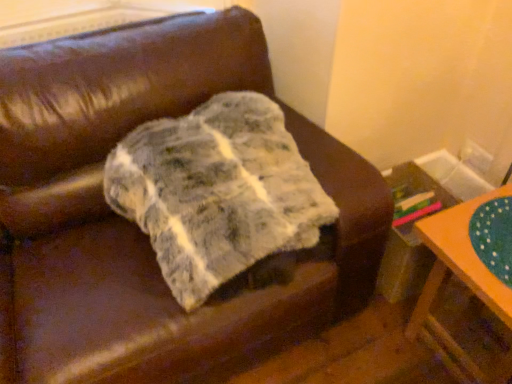
This screenshot has width=512, height=384. What do you see at coordinates (468, 275) in the screenshot?
I see `orange painted wood table at lower right` at bounding box center [468, 275].

The width and height of the screenshot is (512, 384). Find the location of `orange painted wood table at lower right`. orange painted wood table at lower right is located at coordinates (468, 275).

Describe the element at coordinates (217, 191) in the screenshot. I see `marble-like fabric at center` at that location.

What are the coordinates of `marble-like fabric at center` in the screenshot? It's located at (217, 191).

Locate an element on the screen. The image size is (512, 384). orange painted wood table at lower right is located at coordinates (468, 275).

Which object is positioned more to the right, marble-like fabric at center or orange painted wood table at lower right?

orange painted wood table at lower right is more to the right.

Between marble-like fabric at center and orange painted wood table at lower right, which one is positioned behind?

Positioned behind is orange painted wood table at lower right.

Considering the positions of point (296, 176) and point (466, 232), is point (296, 176) closer or farther from the camera than point (466, 232)?

Point (296, 176) is positioned farther from the camera compared to point (466, 232).

From the image's perspective, which is below, marble-like fabric at center or orange painted wood table at lower right?

orange painted wood table at lower right is shown below in the image.

From a real-world perspective, is marble-like fabric at center beneath orange painted wood table at lower right?

No, from a real-world perspective, marble-like fabric at center is not under orange painted wood table at lower right.

Looking at their sizes, would you say marble-like fabric at center is wider or thinner than orange painted wood table at lower right?

Considering their sizes, marble-like fabric at center looks broader than orange painted wood table at lower right.

From the picture: Considering the sizes of marble-like fabric at center and orange painted wood table at lower right in the image, is marble-like fabric at center taller or shorter than orange painted wood table at lower right?

Considering their sizes, marble-like fabric at center has less height than orange painted wood table at lower right.

Considering the sizes of objects marble-like fabric at center and orange painted wood table at lower right in the image provided, who is smaller, marble-like fabric at center or orange painted wood table at lower right?

orange painted wood table at lower right is smaller.

Can we say marble-like fabric at center lies outside orange painted wood table at lower right?

Absolutely, marble-like fabric at center is external to orange painted wood table at lower right.

Are marble-like fabric at center and orange painted wood table at lower right beside each other?

No, marble-like fabric at center is not touching orange painted wood table at lower right.

Is marble-like fabric at center turned away from orange painted wood table at lower right?

No, orange painted wood table at lower right is not at the back of marble-like fabric at center.

How many degrees apart are the facing directions of marble-like fabric at center and orange painted wood table at lower right?

They differ by 93.9 degrees in their facing directions.

You are a GUI agent. You are given a task and a screenshot of the screen. Output one action in this format:
    pyautogui.click(x=<x>, y=<y>)
    Task: Click on the blanket above the orange painted wood table at lower right (from a real-world perspective)
    This screenshot has height=384, width=512.
    Given the screenshot: What is the action you would take?
    pyautogui.click(x=217, y=191)

Does orange painted wood table at lower right appear on the right side of marble-like fabric at center?

Yes.

Which is in front, orange painted wood table at lower right or marble-like fabric at center?

marble-like fabric at center.

Considering the positions of point (426, 221) and point (222, 239), is point (426, 221) closer or farther from the camera than point (222, 239)?

Clearly, point (426, 221) is more distant from the camera than point (222, 239).

From the image's perspective, between orange painted wood table at lower right and marble-like fabric at center, which one is located above?

marble-like fabric at center appears higher in the image.

From a real-world perspective, is orange painted wood table at lower right above or below marble-like fabric at center?

In terms of real-world spatial position, orange painted wood table at lower right is below marble-like fabric at center.

Does orange painted wood table at lower right have a greater width compared to marble-like fabric at center?

Incorrect, the width of orange painted wood table at lower right does not surpass that of marble-like fabric at center.

Between orange painted wood table at lower right and marble-like fabric at center, which one has less height?

With less height is marble-like fabric at center.

Considering the sizes of objects orange painted wood table at lower right and marble-like fabric at center in the image provided, who is bigger, orange painted wood table at lower right or marble-like fabric at center?

Bigger between the two is marble-like fabric at center.

Would you say orange painted wood table at lower right is outside marble-like fabric at center?

Indeed, orange painted wood table at lower right is completely outside marble-like fabric at center.

Is orange painted wood table at lower right touching marble-like fabric at center?

orange painted wood table at lower right and marble-like fabric at center are clearly separated.

Is orange painted wood table at lower right oriented towards marble-like fabric at center?

No, orange painted wood table at lower right does not turn towards marble-like fabric at center.

Find the location of a particular element. table lying behind the marble-like fabric at center is located at coordinates (468, 275).

You are a GUI agent. You are given a task and a screenshot of the screen. Output one action in this format:
    pyautogui.click(x=<x>, y=<y>)
    Task: Click on the blanket located above the orange painted wood table at lower right (from a real-world perspective)
    This screenshot has width=512, height=384.
    Given the screenshot: What is the action you would take?
    pyautogui.click(x=217, y=191)

You are a GUI agent. You are given a task and a screenshot of the screen. Output one action in this format:
    pyautogui.click(x=<x>, y=<y>)
    Task: Click on the table lying on the right of marble-like fabric at center
    The height and width of the screenshot is (384, 512).
    Given the screenshot: What is the action you would take?
    pyautogui.click(x=468, y=275)